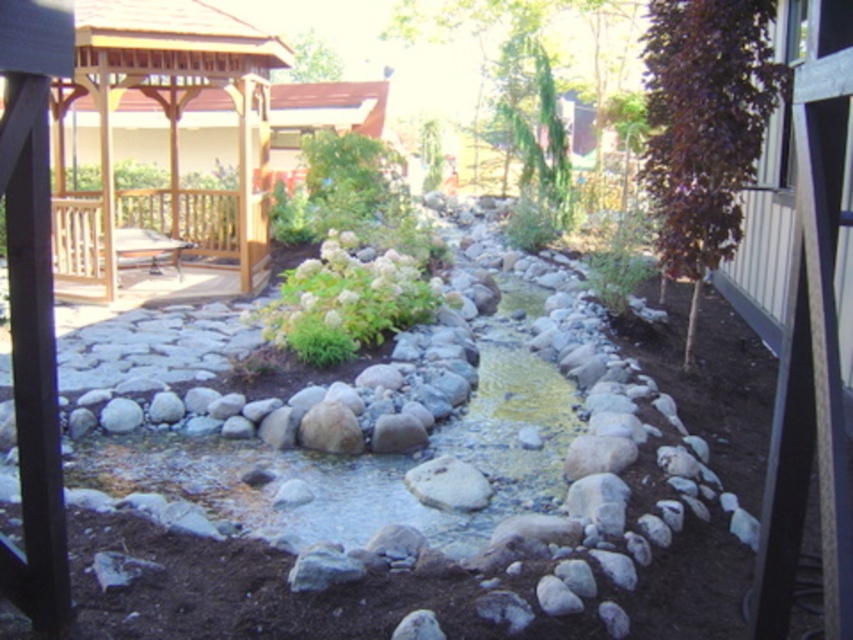
You are standing at the entrance of the wooden gazebo at upper left and want to sit down. Is the wooden bench at left located below or above the gazebo?

The wooden gazebo at upper left is above the wooden bench at left, so the bench is located below the gazebo.

You are planning to set up a small picnic table between the wooden gazebo at upper left and the white fluffy bush at center. The picnic table requires a space of 8 feet. Will there be enough space to place it between them?

The distance between the wooden gazebo at upper left and the white fluffy bush at center is 8.48 feet, which is more than the required 8 feet. Therefore, there is enough space to place the picnic table between them.

You are planning to place a small garden statue in the garden scene. The statue requires a flat, open space that is not covered by any objects. Based on the scene, can the white fluffy bush at center be placed under the wooden gazebo at upper left to make space for the statue?

The wooden gazebo at upper left is positioned over the white fluffy bush at center, so placing the white fluffy bush at center under the wooden gazebo at upper left would not create additional open space for the statue since it is already under the gazebo.